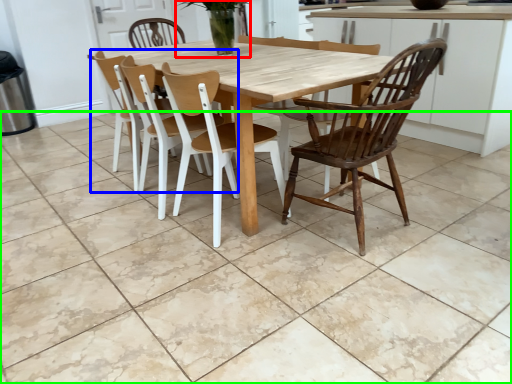
Question: Estimate the real-world distances between objects in this image. Which object is closer to plant (highlighted by a red box), chair (highlighted by a blue box) or tile (highlighted by a green box)?

Choices:
 (A) chair
 (B) tile

Answer: (A)